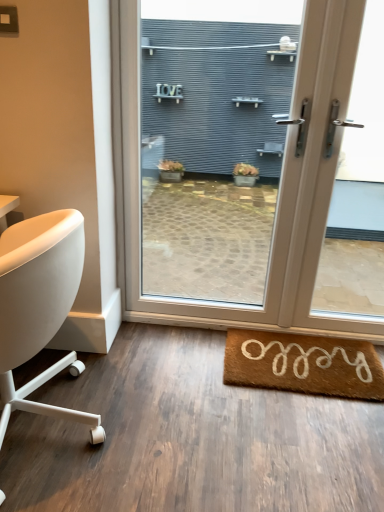
Where is `empty space that is ontop of brown coir mat at lower right`? This screenshot has width=384, height=512. empty space that is ontop of brown coir mat at lower right is located at coordinates (314, 353).